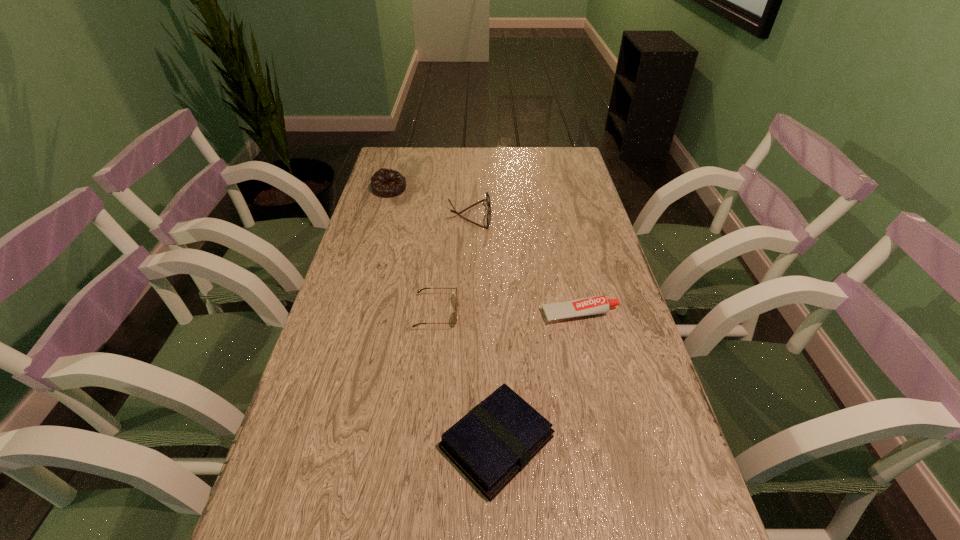
Locate an element on the screen. This screenshot has width=960, height=540. vacant area that lies between the beanbag and the book is located at coordinates (443, 316).

You are a GUI agent. You are given a task and a screenshot of the screen. Output one action in this format:
    pyautogui.click(x=<x>, y=<y>)
    Task: Click on the free space between the nearest object and the sunglasses
    This screenshot has height=540, width=960.
    Given the screenshot: What is the action you would take?
    pyautogui.click(x=467, y=377)

Locate an element on the screen. The image size is (960, 540). vacant area that lies between the rightmost object and the leftmost object is located at coordinates (485, 252).

Locate an element on the screen. free space between the beanbag and the toothpaste is located at coordinates (485, 252).

Image resolution: width=960 pixels, height=540 pixels. What are the coordinates of `free spot between the leftmost object and the fourth nearest object` in the screenshot? It's located at (430, 202).

Locate an element on the screen. The height and width of the screenshot is (540, 960). vacant point located between the farthest object and the sunglasses is located at coordinates point(413,251).

Locate an element on the screen. The height and width of the screenshot is (540, 960). free space between the toothpaste and the book is located at coordinates (539, 379).

At what (x,y) coordinates should I click in order to perform the action: click on empty space that is in between the spectacles and the sunglasses. Please return your answer as a coordinate pair (x, y). The height and width of the screenshot is (540, 960). Looking at the image, I should click on (453, 264).

This screenshot has height=540, width=960. Identify the location of vacant point located between the rightmost object and the beanbag. (485, 252).

Identify the location of object that is the second closest one to the farthest object. The height and width of the screenshot is (540, 960). (x=455, y=314).